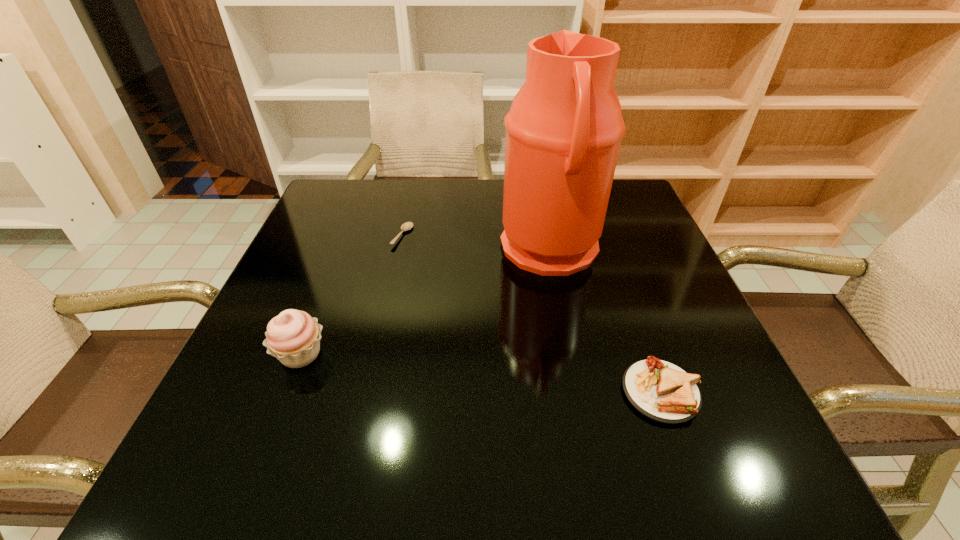
The image size is (960, 540). I want to click on free space that satisfies the following two spatial constraints: 1. from the spout of the second shortest object; 2. on the right side of the water jug, so click(578, 392).